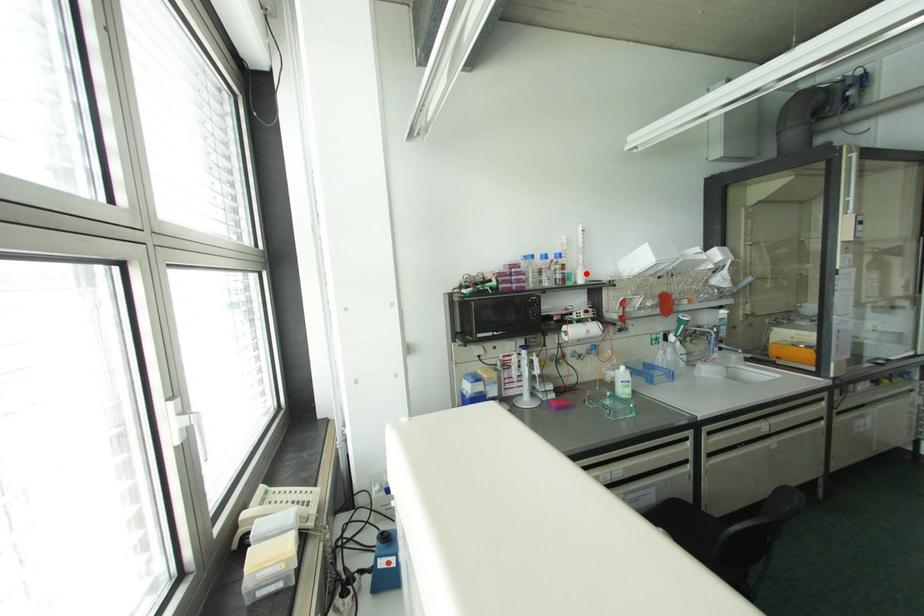
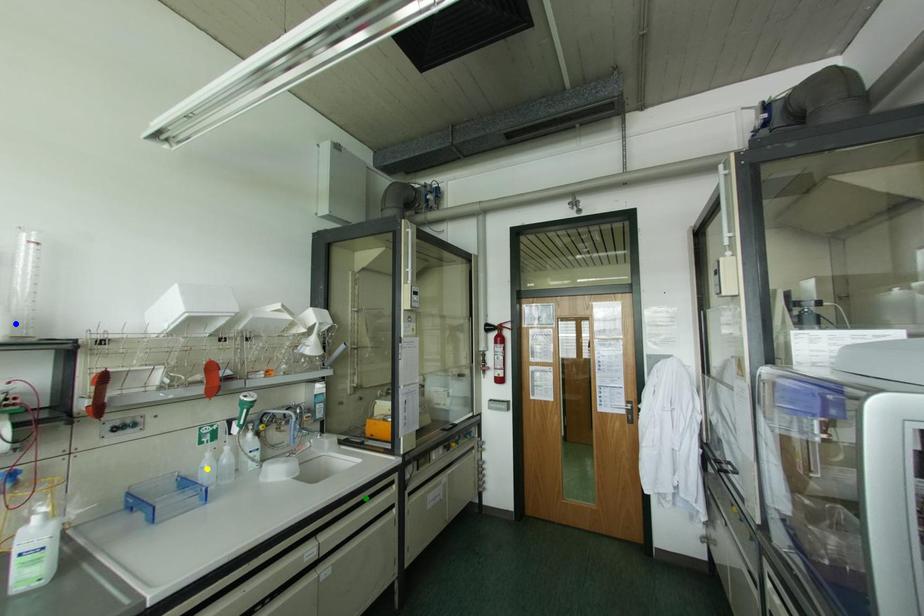
Question: I am providing you with two images of the same scene from different viewpoints. A red point is marked on the first image. You are given multiple points on the second image. Which spot in image 2 lines up with the point in image 1?

Choices:
 (A) green point
 (B) blue point
 (C) yellow point

Answer: (B)